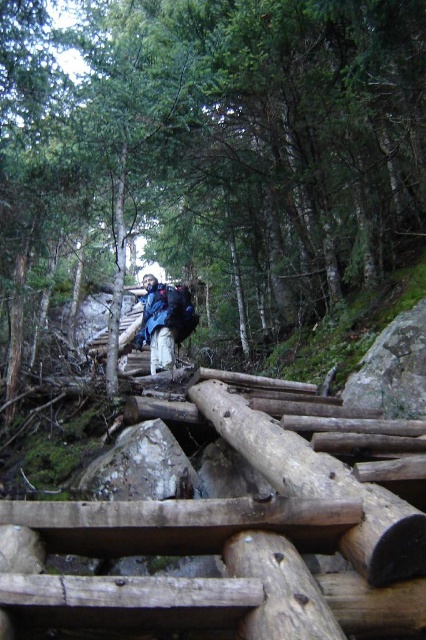
You are standing at the bottom of the rustic wooden staircase and see the green matte tree at center and the blue fabric backpack at center. Which object is taller?

The green matte tree at center is much taller than the blue fabric backpack at center.

You are hiking and see the green matte tree at center and the blue fabric backpack at center. Which object is larger in size?

The green matte tree at center is bigger than the blue fabric backpack at center.

You are standing at the bottom of the rustic wooden staircase in the forest. You notice a specific point marked at coordinates (216, 147). Based on the scene, can you determine what object this point is located on?

The point at coordinates (216, 147) is located on the green matte tree at center.